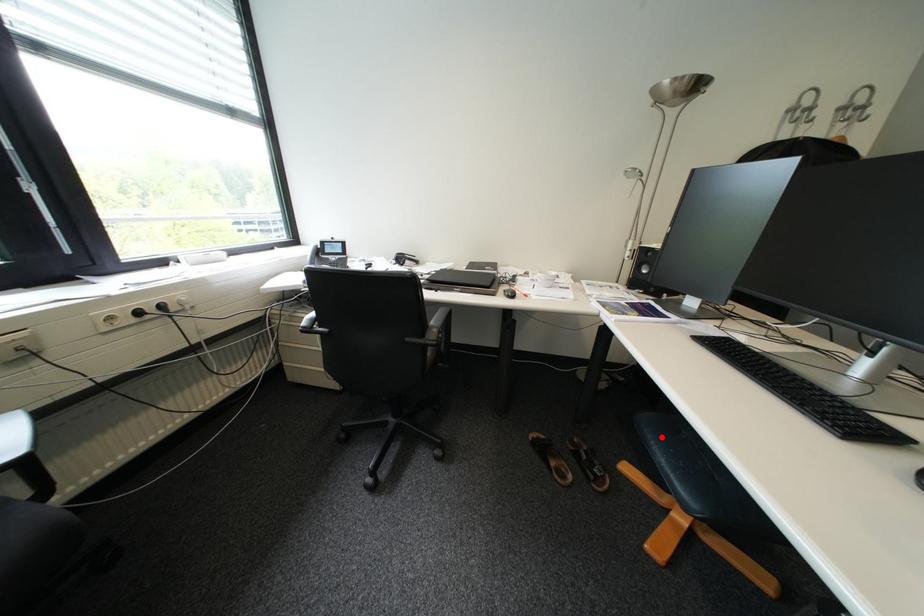
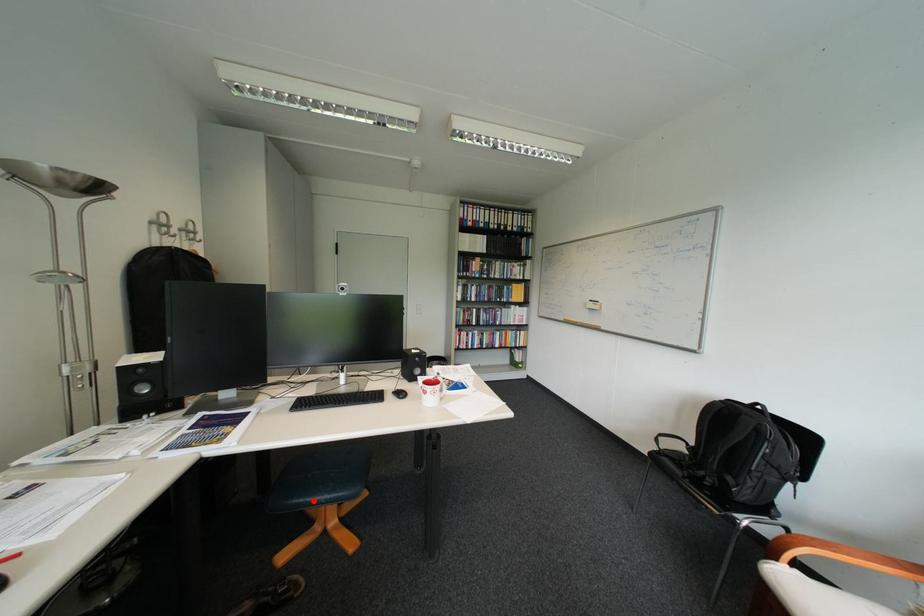
I am providing you with two images of the same scene from different viewpoints. A red point is marked on the first image and another point is marked on the second image. Does the point marked in image1 correspond to the same location as the one in image2?

Yes